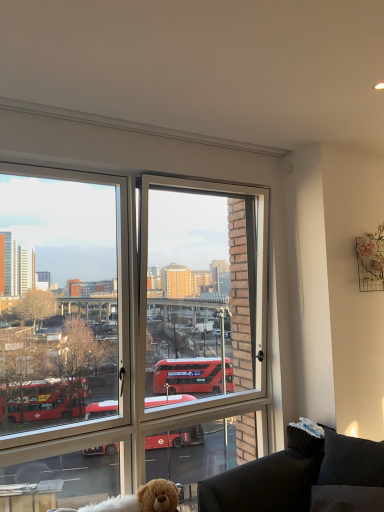
Measure the distance between transparent glass window at center and camera.

The distance of transparent glass window at center from camera is 2.79 meters.

What do you see at coordinates (64, 339) in the screenshot?
I see `transparent glass window at center` at bounding box center [64, 339].

Image resolution: width=384 pixels, height=512 pixels. What are the coordinates of `transparent glass window at center` in the screenshot? It's located at (64, 339).

Identify the location of transparent glass window at center. The width and height of the screenshot is (384, 512). (64, 339).